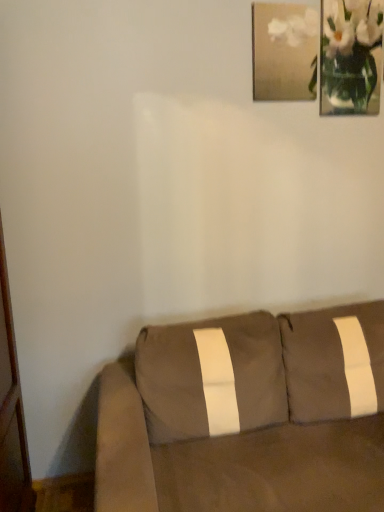
Question: From the image's perspective, is suede brown couch at lower right positioned above or below matte gold picture frame at upper right?

Choices:
 (A) above
 (B) below

Answer: (B)

Question: In terms of width, does suede brown couch at lower right look wider or thinner when compared to matte gold picture frame at upper right?

Choices:
 (A) thin
 (B) wide

Answer: (B)

Question: Which is farther from the matte gold picture frame at upper right?

Choices:
 (A) white glass vase at upper right
 (B) suede brown couch at lower right

Answer: (B)

Question: Which object is the farthest from the matte gold picture frame at upper right?

Choices:
 (A) white glass vase at upper right
 (B) suede brown couch at lower right

Answer: (B)